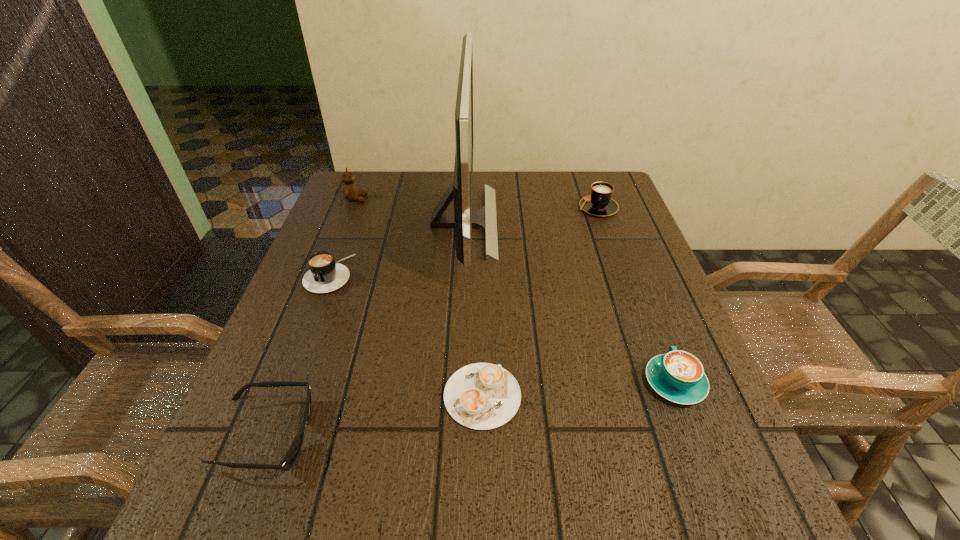
Locate an element on the screen. This screenshot has height=540, width=960. object located in the near edge section of the desktop is located at coordinates (289, 459).

At what (x,y) coordinates should I click in order to perform the action: click on teddy bear positioned at the left edge. Please return your answer as a coordinate pair (x, y). Looking at the image, I should click on [x=350, y=191].

The image size is (960, 540). I want to click on cappuccino present at the left edge, so click(x=325, y=275).

Where is `sunglasses located at the left edge`? Image resolution: width=960 pixels, height=540 pixels. sunglasses located at the left edge is located at coordinates (289, 459).

Locate an element on the screen. This screenshot has width=960, height=540. object situated at the far left corner is located at coordinates (350, 191).

The image size is (960, 540). I want to click on object that is at the near left corner, so pyautogui.click(x=289, y=459).

Locate an element on the screen. object that is at the far right corner is located at coordinates (599, 203).

Locate an element on the screen. This screenshot has height=540, width=960. vacant area at the far edge of the desktop is located at coordinates (483, 195).

Where is `vacant space at the near edge`? The width and height of the screenshot is (960, 540). vacant space at the near edge is located at coordinates (492, 504).

At what (x,y) coordinates should I click in order to perform the action: click on free space at the left edge of the desktop. Please return your answer as a coordinate pair (x, y). The image size is (960, 540). Looking at the image, I should click on click(267, 447).